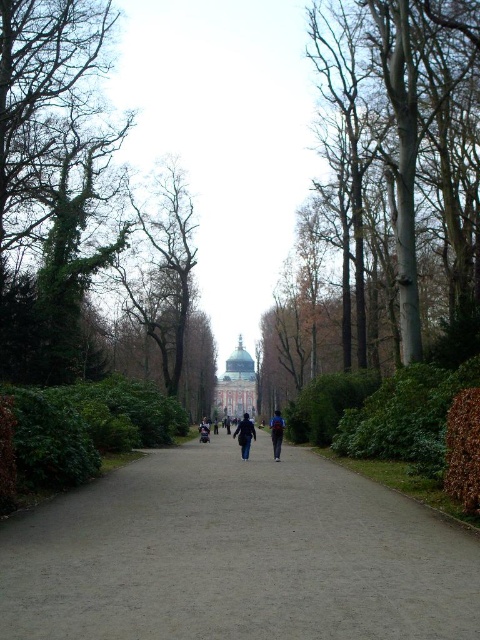
Is the position of green leafy hedge at lower left less distant than that of matte gold dome at center?

That is True.

Is point (12, 387) more distant than point (232, 355)?

No, (12, 387) is in front of (232, 355).

Is point (96, 417) farther from camera compared to point (251, 378)?

No, (96, 417) is in front of (251, 378).

The height and width of the screenshot is (640, 480). I want to click on green leafy hedge at lower left, so click(84, 428).

Does brown smooth tree at center have a greater height compared to dark blue jacket at center?

Yes, brown smooth tree at center is taller than dark blue jacket at center.

Does brown smooth tree at center have a lesser width compared to dark blue jacket at center?

No.

The height and width of the screenshot is (640, 480). Find the location of `brown smooth tree at center`. brown smooth tree at center is located at coordinates (398, 166).

Does gray gravel path at center have a larger size compared to dark blue jeans at center?

No.

Locate an element on the screen. The image size is (480, 640). gray gravel path at center is located at coordinates (236, 556).

Does point (296, 474) come behind point (276, 440)?

No, (296, 474) is closer to viewer.

This screenshot has height=640, width=480. In order to click on gray gravel path at center in this screenshot , I will do `click(236, 556)`.